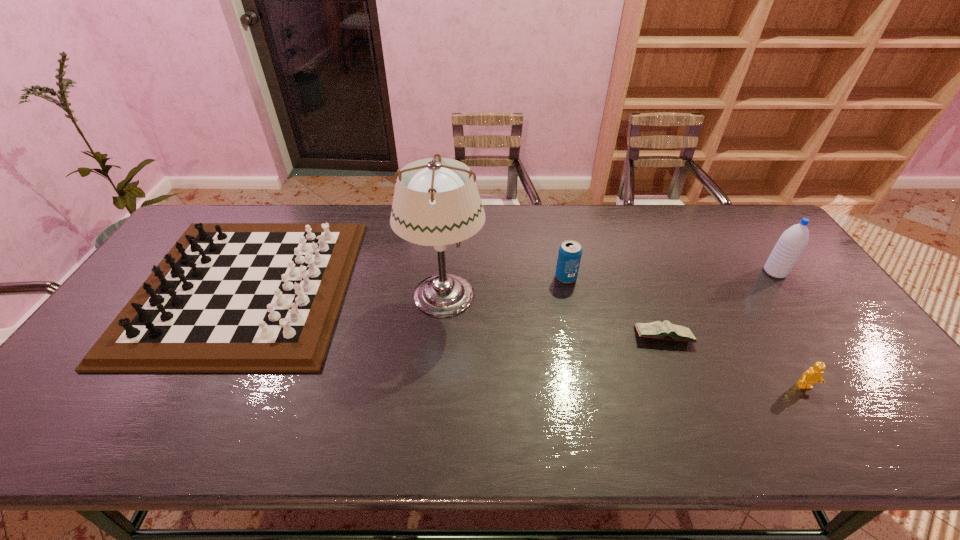
In the image, there is a desktop. At what (x,y) coordinates should I click in order to perform the action: click on blank space at the far edge. Please return your answer as a coordinate pair (x, y). The height and width of the screenshot is (540, 960). Looking at the image, I should click on (594, 235).

Image resolution: width=960 pixels, height=540 pixels. Identify the location of vacant space at the near edge of the desktop. (616, 420).

At what (x,y) coordinates should I click in order to perform the action: click on free point at the right edge. Please return your answer as a coordinate pair (x, y). Looking at the image, I should click on (793, 268).

The image size is (960, 540). Find the location of `vacant region at the far left corner of the desktop`. vacant region at the far left corner of the desktop is located at coordinates (199, 216).

The height and width of the screenshot is (540, 960). Find the location of `vacant space at the near right corner of the desktop`. vacant space at the near right corner of the desktop is located at coordinates click(x=936, y=435).

Identify the location of vacant area between the shortest object and the lampshade. This screenshot has height=540, width=960. (554, 316).

Where is `free space between the rightmost object and the third object from left to right`? The height and width of the screenshot is (540, 960). free space between the rightmost object and the third object from left to right is located at coordinates (670, 275).

Find the location of a particular element. The width and height of the screenshot is (960, 540). vacant space that's between the fourth object from left to right and the second shortest object is located at coordinates (734, 362).

At what (x,y) coordinates should I click in order to perform the action: click on free space between the fourth object from left to right and the water bottle. Please return your answer as a coordinate pair (x, y). This screenshot has height=540, width=960. Looking at the image, I should click on (719, 305).

You are a GUI agent. You are given a task and a screenshot of the screen. Output one action in this format:
    pyautogui.click(x=<x>, y=<y>)
    Task: Click on the free space between the fourth object from right to left and the shortest object
    The width and height of the screenshot is (960, 540).
    Given the screenshot: What is the action you would take?
    pyautogui.click(x=614, y=307)